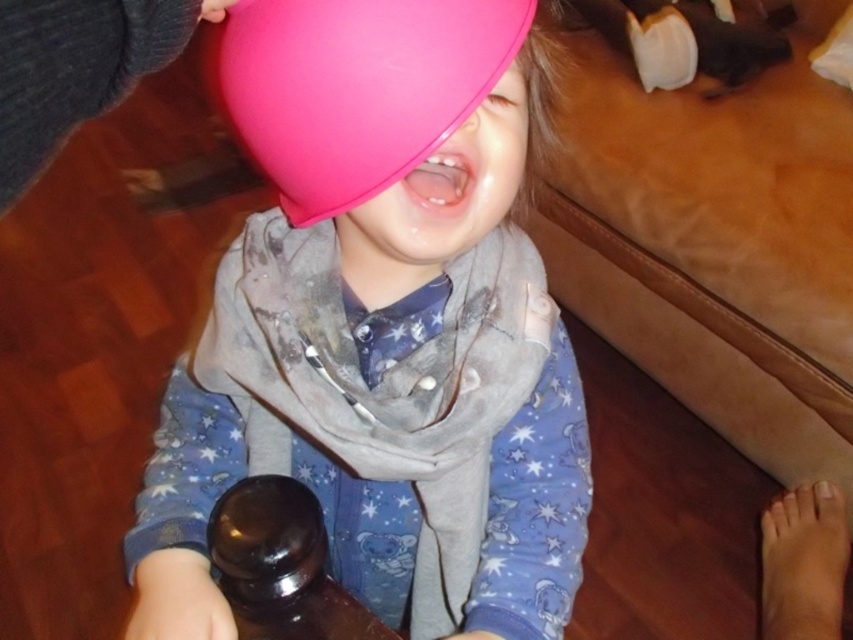
Which of these two, matte pink balloon at center or pink rubber balloon at upper center, stands shorter?

Standing shorter between the two is pink rubber balloon at upper center.

Does matte pink balloon at center have a greater height compared to pink rubber balloon at upper center?

Indeed, matte pink balloon at center has a greater height compared to pink rubber balloon at upper center.

Does point (325, 163) come closer to viewer compared to point (328, 20)?

No, it is not.

Locate an element on the screen. matte pink balloon at center is located at coordinates (381, 328).